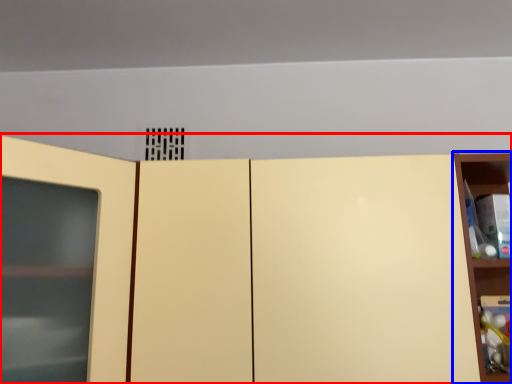
Question: Among these objects, which one is farthest to the camera, cupboard (highlighted by a red box) or shelf (highlighted by a blue box)?

Choices:
 (A) cupboard
 (B) shelf

Answer: (B)